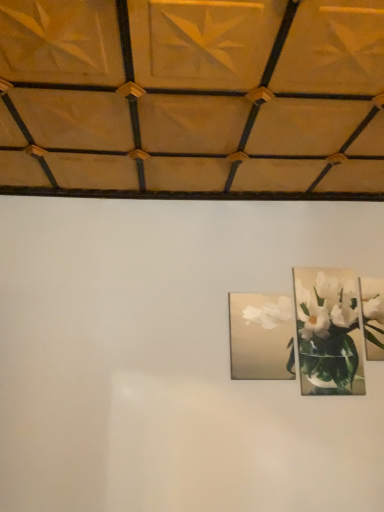
Question: Considering the positions of metallic silver picture frame at upper right, the third picture frame when ordered from left to right, and metallic silver frame at upper right, marked as the 2th picture frame in a right-to-left arrangement, in the image, is metallic silver picture frame at upper right, the third picture frame when ordered from left to right, wider or thinner than metallic silver frame at upper right, marked as the 2th picture frame in a right-to-left arrangement,?

Choices:
 (A) wide
 (B) thin

Answer: (A)

Question: From the image's perspective, is metallic silver picture frame at upper right, the third picture frame when ordered from left to right, above or below metallic silver frame at upper right, which is the 2th picture frame in left-to-right order?

Choices:
 (A) above
 (B) below

Answer: (A)

Question: Considering the real-world distances, which object is farthest from the metallic silver frame at upper right, which is the 2th picture frame in left-to-right order?

Choices:
 (A) matte silver picture frame at center, which appears as the third picture frame when viewed from the right
 (B) metallic silver picture frame at upper right, the third picture frame when ordered from left to right

Answer: (A)

Question: Which object is the farthest from the matte silver picture frame at center, which appears as the third picture frame when viewed from the right?

Choices:
 (A) metallic silver frame at upper right, which is the 2th picture frame in left-to-right order
 (B) metallic silver picture frame at upper right, the first picture frame when ordered from right to left

Answer: (B)